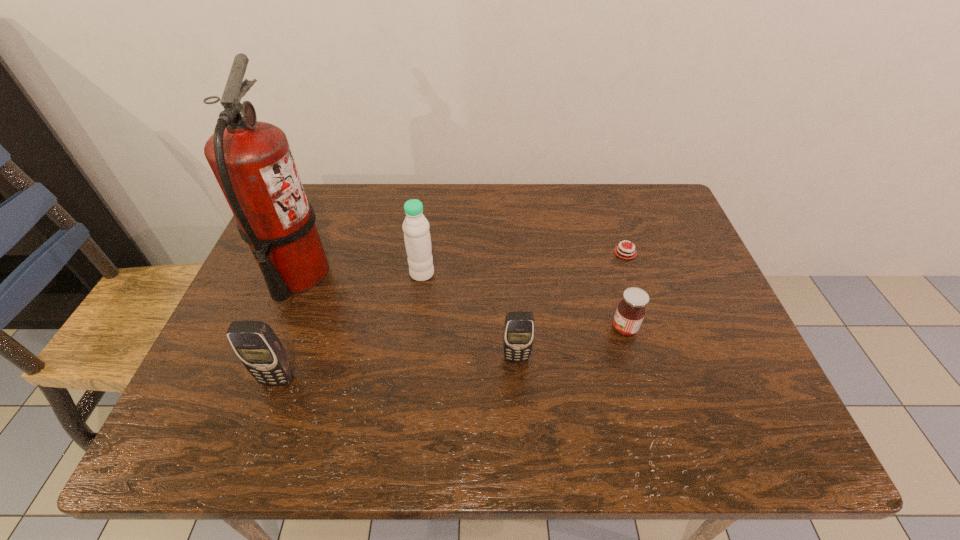
The width and height of the screenshot is (960, 540). In order to click on empty location between the water bottle and the taller cellular telephone in this screenshot , I will do click(x=349, y=327).

Locate an element on the screen. This screenshot has height=540, width=960. vacant space that is in between the fire extinguisher and the fourth object from left to right is located at coordinates (407, 315).

The height and width of the screenshot is (540, 960). In order to click on free spot between the jam and the tallest object in this screenshot , I will do `click(461, 301)`.

The width and height of the screenshot is (960, 540). Identify the location of empty space that is in between the shortest object and the taller cellular telephone. (451, 316).

Find the location of a particular element. free point between the right cellular telephone and the tallest object is located at coordinates (407, 315).

This screenshot has width=960, height=540. I want to click on empty space that is in between the tallest object and the shortest object, so click(x=461, y=263).

This screenshot has height=540, width=960. Identify the location of empty space between the chocolate cake and the fifth shortest object. (523, 263).

At what (x,y) coordinates should I click in order to perform the action: click on vacant space that's between the third nearest object and the chocolate cake. Please return your answer as a coordinate pair (x, y). This screenshot has height=540, width=960. Looking at the image, I should click on (625, 291).

Point out which object is positioned as the fourth nearest to the nearer cellular telephone. Please provide its 2D coordinates. Your answer should be formatted as a tuple, i.e. [(x, y)], where the tuple contains the x and y coordinates of a point satisfying the conditions above.

[(630, 312)]

Identify the location of the closest object to the second tallest object. (252, 161).